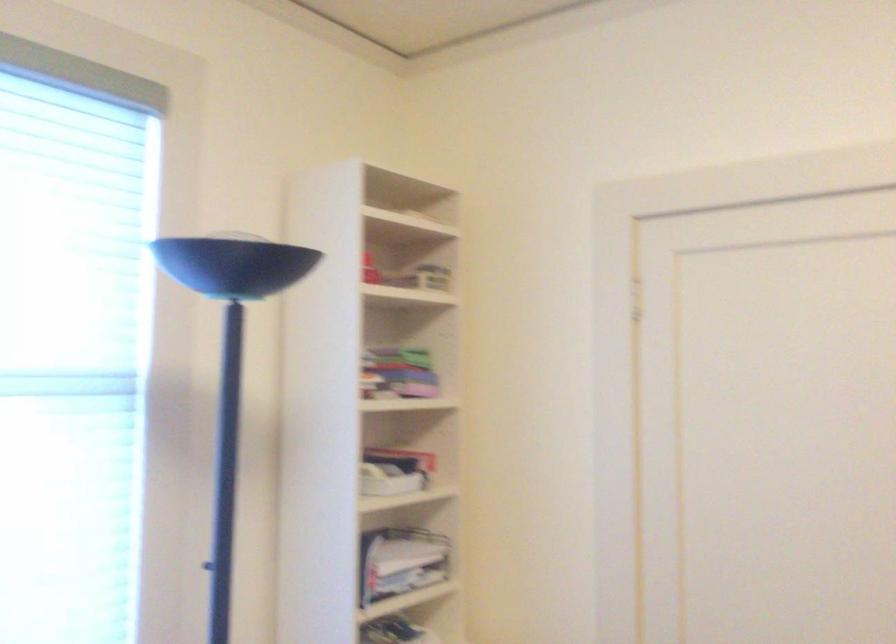
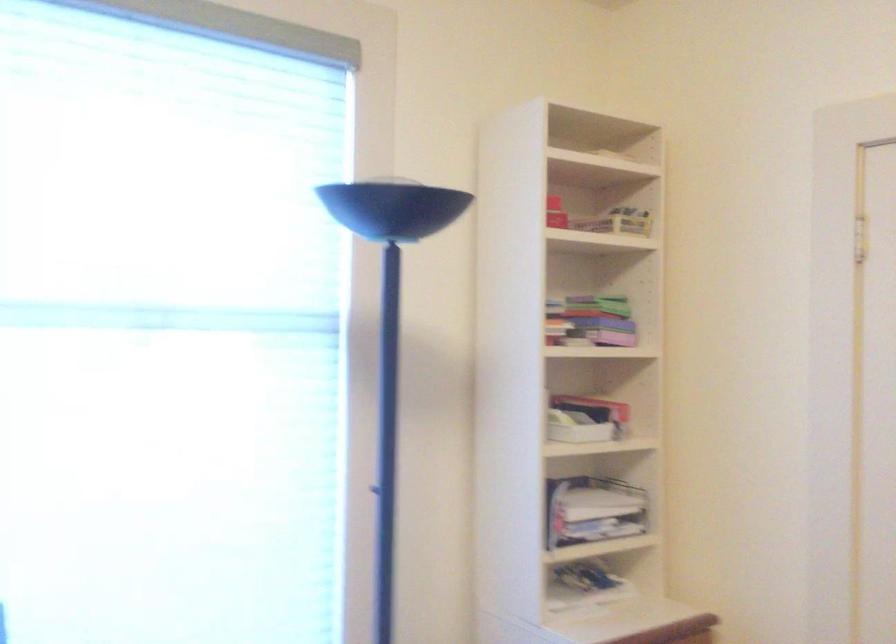
In the second image, find the point that corresponds to point 389,480 in the first image.

(576, 428)